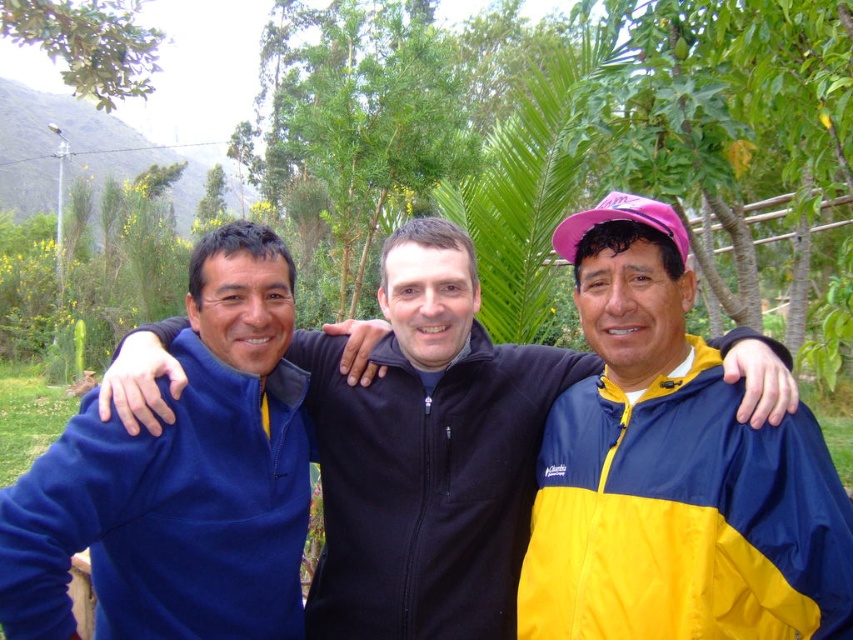
Does yellowshiny fabricjacket at right appear under blue fleece jacket at left?

Actually, yellowshiny fabricjacket at right is above blue fleece jacket at left.

Can you confirm if yellowshiny fabricjacket at right is wider than blue fleece jacket at left?

No, yellowshiny fabricjacket at right is not wider than blue fleece jacket at left.

At what (x,y) coordinates should I click in order to perform the action: click on yellowshiny fabricjacket at right. Please return your answer as a coordinate pair (x, y). The height and width of the screenshot is (640, 853). Looking at the image, I should click on (683, 518).

Between point (399, 353) and point (677, 616), which one is positioned behind?

Positioned behind is point (399, 353).

The width and height of the screenshot is (853, 640). In order to click on blue fleece jacket at center in this screenshot , I will do `click(426, 452)`.

You are a GUI agent. You are given a task and a screenshot of the screen. Output one action in this format:
    pyautogui.click(x=<x>, y=<y>)
    Task: Click on the blue fleece jacket at center
    The height and width of the screenshot is (640, 853).
    Given the screenshot: What is the action you would take?
    pyautogui.click(x=426, y=452)

Is blue fleece jacket at center bigger than blue fleece jacket at left?

Correct, blue fleece jacket at center is larger in size than blue fleece jacket at left.

Measure the distance from blue fleece jacket at center to blue fleece jacket at left.

They are 18.74 inches apart.

Who is more forward, (357,580) or (276,502)?

Point (276,502) is more forward.

At what (x,y) coordinates should I click in order to perform the action: click on blue fleece jacket at center. Please return your answer as a coordinate pair (x, y). The height and width of the screenshot is (640, 853). Looking at the image, I should click on (426, 452).